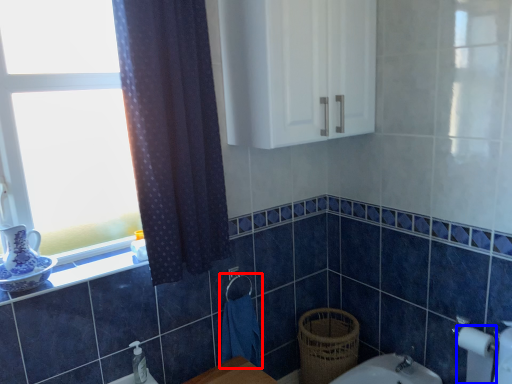
Question: Which object appears farthest to the camera in this image, hand towel (highlighted by a red box) or toilet paper (highlighted by a blue box)?

Choices:
 (A) hand towel
 (B) toilet paper

Answer: (A)